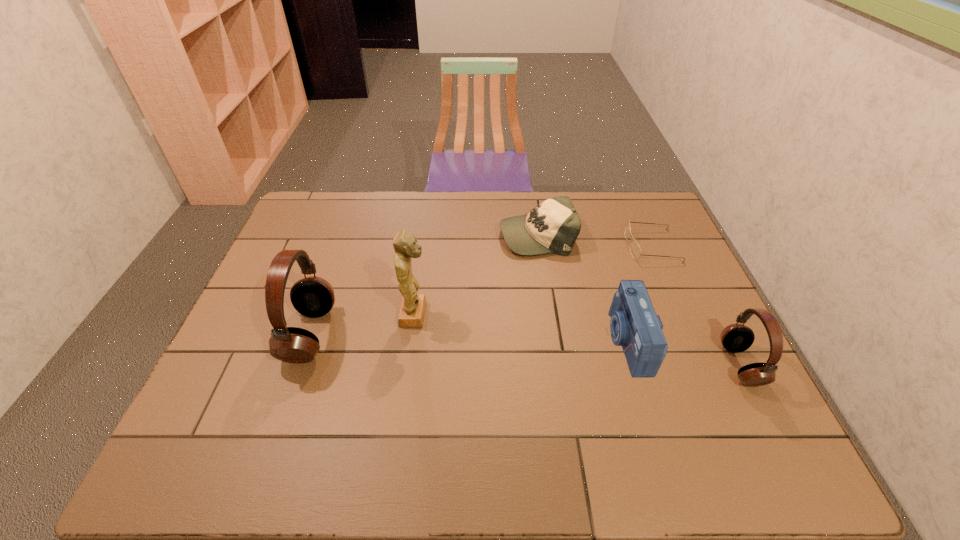
Where is `free location located on the ear pads of the leftmost object`? free location located on the ear pads of the leftmost object is located at coordinates (381, 334).

Find the location of a particular element. free spot located on the ear pads of the shorter headset is located at coordinates (624, 365).

At what (x,y) coordinates should I click in order to perform the action: click on vacant space located on the ear pads of the shorter headset. Please return your answer as a coordinate pair (x, y). The image size is (960, 540). Looking at the image, I should click on [640, 365].

Where is `free space located on the ear pads of the shorter headset`? free space located on the ear pads of the shorter headset is located at coordinates (644, 365).

In order to click on vacant space situated on the front-facing side of the fifth tallest object in this screenshot , I will do `click(412, 235)`.

You are a GUI agent. You are given a task and a screenshot of the screen. Output one action in this format:
    pyautogui.click(x=<x>, y=<y>)
    Task: Click on the vacant area located on the front-facing side of the fifth tallest object
    This screenshot has height=540, width=960.
    Given the screenshot: What is the action you would take?
    pyautogui.click(x=472, y=235)

The height and width of the screenshot is (540, 960). In order to click on free space located on the front-facing side of the fifth tallest object in this screenshot , I will do `click(412, 235)`.

Where is `vacant space located 0.190m on the front-facing side of the shortest object`? This screenshot has height=540, width=960. vacant space located 0.190m on the front-facing side of the shortest object is located at coordinates (568, 246).

The height and width of the screenshot is (540, 960). I want to click on vacant region located 0.180m on the front-facing side of the shortest object, so click(x=571, y=246).

Locate an element on the screen. vacant region located 0.280m on the front-facing side of the shortest object is located at coordinates (540, 246).